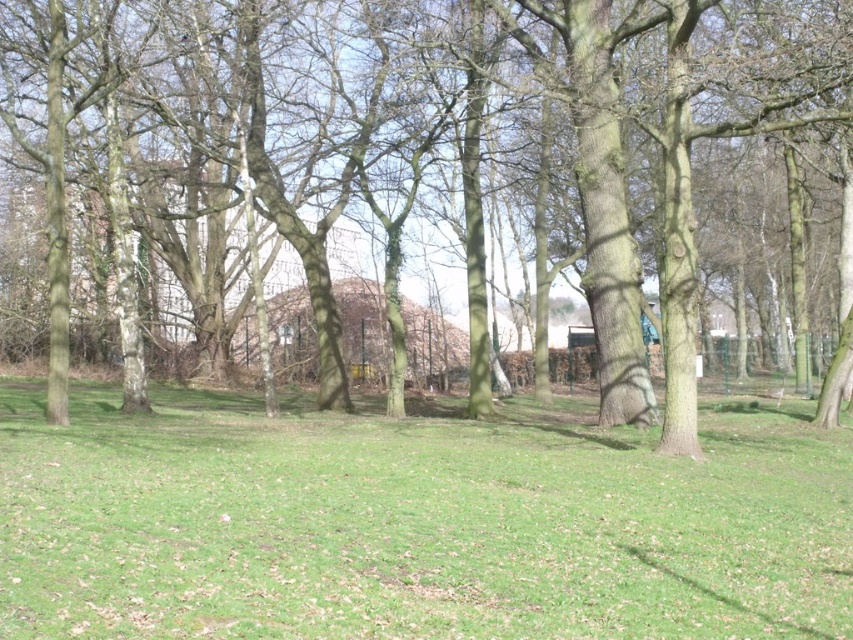
Question: Is green grassy field at center positioned before brown rough tree at center?

Choices:
 (A) yes
 (B) no

Answer: (A)

Question: Which point is farther to the camera?

Choices:
 (A) green grassy field at center
 (B) brown rough tree at center

Answer: (B)

Question: Which point is closer to the camera?

Choices:
 (A) brown rough tree at center
 (B) green grassy field at center

Answer: (B)

Question: Where is green grassy field at center located in relation to brown rough tree at center in the image?

Choices:
 (A) right
 (B) left

Answer: (B)

Question: Can you confirm if green grassy field at center is positioned above brown rough tree at center?

Choices:
 (A) yes
 (B) no

Answer: (B)

Question: Which point appears farthest from the camera in this image?

Choices:
 (A) (595, 19)
 (B) (788, 436)

Answer: (B)